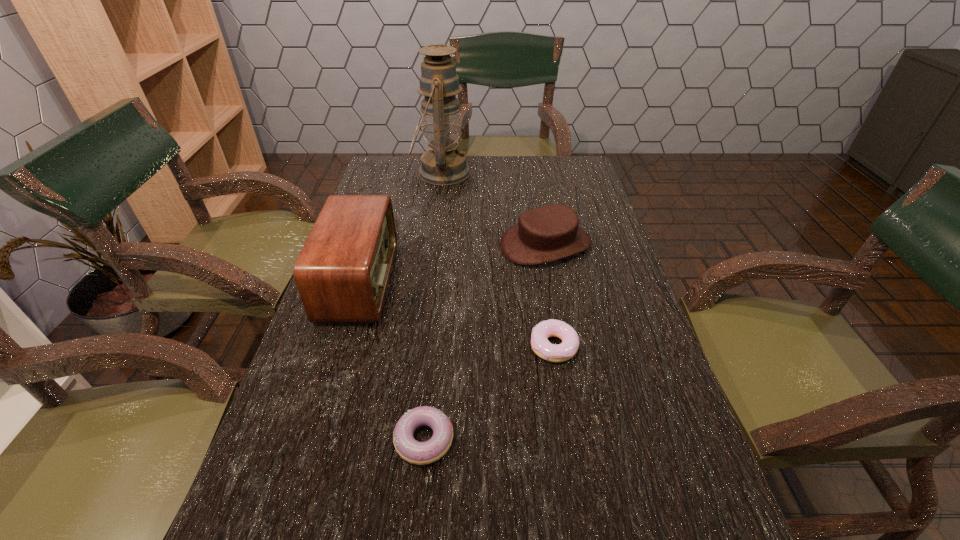
You are a GUI agent. You are given a task and a screenshot of the screen. Output one action in this format:
    pyautogui.click(x=<x>, y=<y>)
    Task: Click on the free space at the far left corner of the desktop
    The image size is (960, 540).
    Given the screenshot: What is the action you would take?
    pyautogui.click(x=373, y=184)

Find the location of a particular element. unoccupied position between the tallest object and the third shortest object is located at coordinates (493, 208).

Where is `vacant area that lies between the oil lamp and the hat`? This screenshot has height=540, width=960. vacant area that lies between the oil lamp and the hat is located at coordinates (493, 208).

Find the location of a particular element. free space between the oil lamp and the right doughnut is located at coordinates 497,260.

Image resolution: width=960 pixels, height=540 pixels. Identify the location of free space between the farther doughnut and the radio receiver. (456, 314).

Locate an element on the screen. This screenshot has height=540, width=960. vacant space in between the tallest object and the left doughnut is located at coordinates (433, 306).

Where is `free point between the third shortest object and the nearest object`? This screenshot has height=540, width=960. free point between the third shortest object and the nearest object is located at coordinates (485, 342).

You are a GUI agent. You are given a task and a screenshot of the screen. Output one action in this format:
    pyautogui.click(x=<x>, y=<y>)
    Task: Click on the free spot between the fourth shortest object and the nearest object
    This screenshot has width=960, height=540.
    Given the screenshot: What is the action you would take?
    pyautogui.click(x=392, y=360)

This screenshot has width=960, height=540. I want to click on vacant space that's between the left doughnut and the second tallest object, so click(x=392, y=360).

Locate an element on the screen. Image resolution: width=960 pixels, height=540 pixels. vacant region between the second tallest object and the oil lamp is located at coordinates (400, 227).